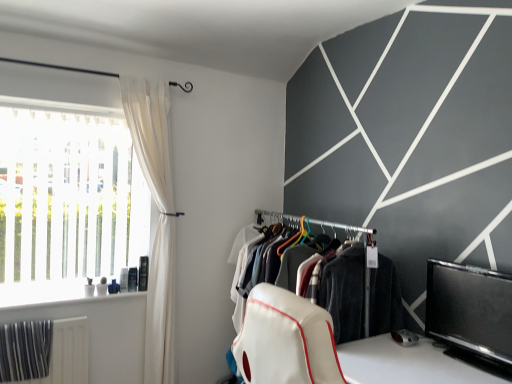
Question: Is white fabric clothes at center wider or thinner than white sheer curtain at left?

Choices:
 (A) wide
 (B) thin

Answer: (A)

Question: Considering the positions of white fabric clothes at center and white sheer curtain at left in the image, is white fabric clothes at center taller or shorter than white sheer curtain at left?

Choices:
 (A) tall
 (B) short

Answer: (B)

Question: Based on their relative distances, which object is nearer to the white fabric clothes at center?

Choices:
 (A) white translucent blinds at left
 (B) black glossy tv at lower right
 (C) white sheer curtain at left
 (D) metallic silver radiator at lower left

Answer: (B)

Question: Estimate the real-world distances between objects in this image. Which object is closer to the metallic silver radiator at lower left?

Choices:
 (A) black glossy tv at lower right
 (B) white translucent blinds at left
 (C) white fabric clothes at center
 (D) white sheer curtain at left

Answer: (D)